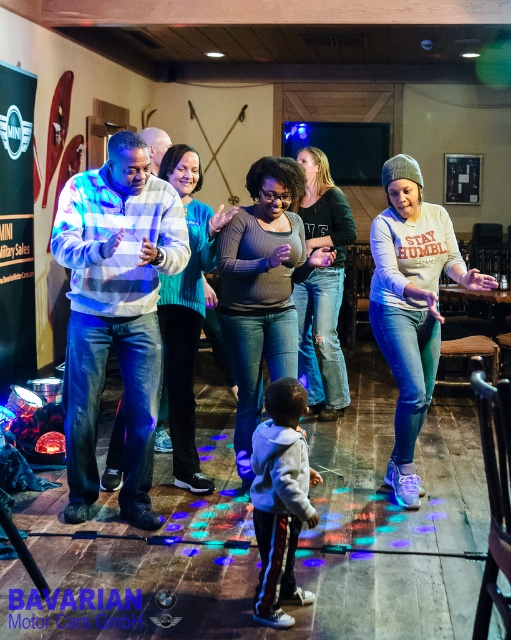
Does striped sweater at center appear under teal sweater at center?

Indeed, striped sweater at center is positioned under teal sweater at center.

Does striped sweater at center have a greater height compared to teal sweater at center?

Incorrect, striped sweater at center's height is not larger of teal sweater at center's.

Is point (100, 349) positioned before point (177, 390)?

Yes.

At what (x,y) coordinates should I click in order to perform the action: click on striped sweater at center. Please return your answer as a coordinate pair (x, y). The height and width of the screenshot is (640, 511). Looking at the image, I should click on (115, 314).

Between point (377, 323) and point (187, 221), which one is positioned in front?

Point (377, 323)

Image resolution: width=511 pixels, height=640 pixels. Find the location of `gray knit beanie at upper right`. gray knit beanie at upper right is located at coordinates (411, 305).

Who is more forward, (378, 307) or (216, 216)?

Point (216, 216) is in front.

You are a GUI agent. You are given a task and a screenshot of the screen. Output one action in this format:
    pyautogui.click(x=<x>, y=<y>)
    Task: Click on the gray knit beanie at upper right
    This screenshot has width=511, height=640.
    Given the screenshot: What is the action you would take?
    pyautogui.click(x=411, y=305)

Can you confirm if teal sweater at center is positioned to the right of dark green sweater at center?

No, teal sweater at center is not to the right of dark green sweater at center.

Does teal sweater at center have a greater width compared to dark green sweater at center?

Yes, teal sweater at center is wider than dark green sweater at center.

Is point (169, 317) farther from viewer compared to point (301, 205)?

No, it is not.

The image size is (511, 640). What are the coordinates of `teal sweater at center` in the screenshot? It's located at (185, 310).